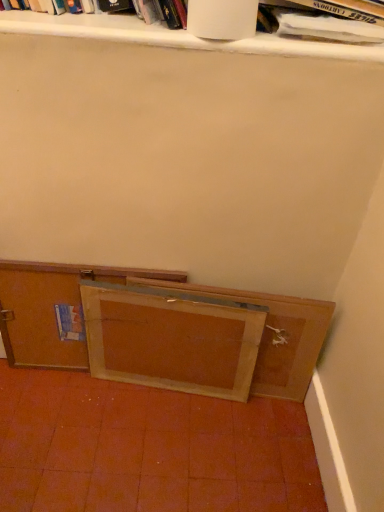
The width and height of the screenshot is (384, 512). What do you see at coordinates (171, 339) in the screenshot?
I see `wooden frame at lower center` at bounding box center [171, 339].

In order to face white paper at upper right, the first book in the right-to-left sequence, should I rotate leftwards or rightwards?

Turn right approximately 16.038 degrees to face it.

What do you see at coordinates (99, 28) in the screenshot? The image size is (384, 512). I see `white matte book at upper center, the second book viewed from the right` at bounding box center [99, 28].

This screenshot has height=512, width=384. Find the location of `wooden cabinet at lower left, the 2th cabinetry in the right-to-left sequence`. wooden cabinet at lower left, the 2th cabinetry in the right-to-left sequence is located at coordinates (53, 310).

Are white matte book at upper center, placed as the 1th book when sorted from left to right, and wooden cabinet at lower left, which ranks as the first cabinetry in left-to-right order, located far from each other?

white matte book at upper center, placed as the 1th book when sorted from left to right, is actually quite close to wooden cabinet at lower left, which ranks as the first cabinetry in left-to-right order.

Which object is closer to the camera, white matte book at upper center, placed as the 1th book when sorted from left to right, or wooden cabinet at lower left, which ranks as the first cabinetry in left-to-right order?

white matte book at upper center, placed as the 1th book when sorted from left to right, is in front.

Is white matte book at upper center, the second book viewed from the right, looking in the opposite direction of wooden cabinet at lower left, which ranks as the first cabinetry in left-to-right order?

No, white matte book at upper center, the second book viewed from the right, is not facing the opposite direction of wooden cabinet at lower left, which ranks as the first cabinetry in left-to-right order.

Which of these two, white matte book at upper center, the second book viewed from the right, or wooden cabinet at lower left, the 2th cabinetry in the right-to-left sequence, stands shorter?

With less height is white matte book at upper center, the second book viewed from the right.

Can you confirm if wooden cabinet at lower left, the 2th cabinetry in the right-to-left sequence, is smaller than white matte book at upper center, the second book viewed from the right?

Yes, wooden cabinet at lower left, the 2th cabinetry in the right-to-left sequence, is smaller than white matte book at upper center, the second book viewed from the right.

Is the position of wooden cabinet at lower left, the 2th cabinetry in the right-to-left sequence, less distant than that of white matte book at upper center, placed as the 1th book when sorted from left to right?

No, wooden cabinet at lower left, the 2th cabinetry in the right-to-left sequence, is further to the viewer.

How different are the orientations of wooden cabinet at lower left, the 2th cabinetry in the right-to-left sequence, and white matte book at upper center, the second book viewed from the right, in degrees?

wooden cabinet at lower left, the 2th cabinetry in the right-to-left sequence, and white matte book at upper center, the second book viewed from the right, are facing 0.236 degrees away from each other.

Which object is positioned more to the left, wooden frame at lower center, marked as the 2th cabinetry in a left-to-right arrangement, or wooden cabinet at lower left, which ranks as the first cabinetry in left-to-right order?

From the viewer's perspective, wooden cabinet at lower left, which ranks as the first cabinetry in left-to-right order, appears more on the left side.

From a real-world perspective, is wooden frame at lower center, the 1th cabinetry viewed from the right, on wooden cabinet at lower left, the 2th cabinetry in the right-to-left sequence?

Incorrect, from a real-world perspective, wooden frame at lower center, the 1th cabinetry viewed from the right, is lower than wooden cabinet at lower left, the 2th cabinetry in the right-to-left sequence.

Can you confirm if wooden frame at lower center, marked as the 2th cabinetry in a left-to-right arrangement, is thinner than wooden cabinet at lower left, which ranks as the first cabinetry in left-to-right order?

Incorrect, the width of wooden frame at lower center, marked as the 2th cabinetry in a left-to-right arrangement, is not less than that of wooden cabinet at lower left, which ranks as the first cabinetry in left-to-right order.

Looking at this image, how far apart are white paper at upper right, which ranks as the second book in left-to-right order, and wooden frame at lower center?

A distance of 65.06 centimeters exists between white paper at upper right, which ranks as the second book in left-to-right order, and wooden frame at lower center.

How many degrees apart are the facing directions of white paper at upper right, the first book in the right-to-left sequence, and wooden frame at lower center?

white paper at upper right, the first book in the right-to-left sequence, and wooden frame at lower center are facing 6.55 degrees away from each other.

At what (x,y) coordinates should I click in order to perform the action: click on wide beneath the white paper at upper right, the first book in the right-to-left sequence (from a real-world perspective). Please return your answer as a coordinate pair (x, y). This screenshot has height=512, width=384. Looking at the image, I should click on (171, 339).

Considering the points (317, 24) and (145, 358), which point is in front, point (317, 24) or point (145, 358)?

The point (317, 24) is more forward.

From a real-world perspective, is white matte book at upper center, placed as the 1th book when sorted from left to right, on white paper at upper right, the first book in the right-to-left sequence?

No.

Identify the location of book below the white paper at upper right, the first book in the right-to-left sequence (from a real-world perspective). (99, 28).

Is white matte book at upper center, placed as the 1th book when sorted from left to right, positioned with its back to white paper at upper right, the first book in the right-to-left sequence?

No, white matte book at upper center, placed as the 1th book when sorted from left to right, is not facing away from white paper at upper right, the first book in the right-to-left sequence.

Is white matte book at upper center, placed as the 1th book when sorted from left to right, wider or thinner than white paper at upper right, the first book in the right-to-left sequence?

white matte book at upper center, placed as the 1th book when sorted from left to right, is wider than white paper at upper right, the first book in the right-to-left sequence.

From the image's perspective, is wooden cabinet at lower left, the 2th cabinetry in the right-to-left sequence, under wooden frame at lower center, the 1th cabinetry viewed from the right?

No, from the image's perspective, wooden cabinet at lower left, the 2th cabinetry in the right-to-left sequence, is not below wooden frame at lower center, the 1th cabinetry viewed from the right.

Considering the points (19, 298) and (64, 339), which point is behind, point (19, 298) or point (64, 339)?

The point (64, 339) is farther.

Considering the relative sizes of wooden cabinet at lower left, which ranks as the first cabinetry in left-to-right order, and wooden frame at lower center, marked as the 2th cabinetry in a left-to-right arrangement, in the image provided, is wooden cabinet at lower left, which ranks as the first cabinetry in left-to-right order, smaller than wooden frame at lower center, marked as the 2th cabinetry in a left-to-right arrangement,?

No.

From a real-world perspective, which object stands above the other?

From a 3D spatial view, white paper at upper right, the first book in the right-to-left sequence, is above.

Is white paper at upper right, the first book in the right-to-left sequence, completely or partially inside wooden frame at lower center, the 1th cabinetry viewed from the right?

No, white paper at upper right, the first book in the right-to-left sequence, is not a part of wooden frame at lower center, the 1th cabinetry viewed from the right.

From the image's perspective, is wooden frame at lower center, marked as the 2th cabinetry in a left-to-right arrangement, located above or below white paper at upper right, the first book in the right-to-left sequence?

Based on their image positions, wooden frame at lower center, marked as the 2th cabinetry in a left-to-right arrangement, is located beneath white paper at upper right, the first book in the right-to-left sequence.

From a real-world perspective, count 1st cabinetrys downward from the white matte book at upper center, the second book viewed from the right, and point to it. Please provide its 2D coordinates.

[(53, 310)]

There is a wooden cabinet at lower left, which ranks as the first cabinetry in left-to-right order. Where is `the 1st book above it (from the image's perspective)`? The image size is (384, 512). the 1st book above it (from the image's perspective) is located at coordinates (99, 28).

Estimate the real-world distances between objects in this image. Which object is further from wooden frame at lower center, wooden cabinet at lower left, which ranks as the first cabinetry in left-to-right order, or white paper at upper right, which ranks as the second book in left-to-right order?

Based on the image, white paper at upper right, which ranks as the second book in left-to-right order, appears to be further to wooden frame at lower center.

Considering their positions, is wooden frame at lower center positioned further to white matte book at upper center, the second book viewed from the right, than wooden frame at lower center, marked as the 2th cabinetry in a left-to-right arrangement?

wooden frame at lower center is further to white matte book at upper center, the second book viewed from the right.

Considering their positions, is white matte book at upper center, the second book viewed from the right, positioned closer to white paper at upper right, which ranks as the second book in left-to-right order, than wooden frame at lower center, marked as the 2th cabinetry in a left-to-right arrangement?

white matte book at upper center, the second book viewed from the right.

Estimate the real-world distances between objects in this image. Which object is closer to white paper at upper right, which ranks as the second book in left-to-right order, wooden frame at lower center, the 1th cabinetry viewed from the right, or wooden cabinet at lower left, which ranks as the first cabinetry in left-to-right order?

wooden frame at lower center, the 1th cabinetry viewed from the right.

Estimate the real-world distances between objects in this image. Which object is further from wooden frame at lower center, wooden cabinet at lower left, the 2th cabinetry in the right-to-left sequence, or white matte book at upper center, placed as the 1th book when sorted from left to right?

Based on the image, white matte book at upper center, placed as the 1th book when sorted from left to right, appears to be further to wooden frame at lower center.

Estimate the real-world distances between objects in this image. Which object is further from wooden cabinet at lower left, which ranks as the first cabinetry in left-to-right order, wooden frame at lower center or white paper at upper right, the first book in the right-to-left sequence?

white paper at upper right, the first book in the right-to-left sequence.

Considering their positions, is wooden cabinet at lower left, which ranks as the first cabinetry in left-to-right order, positioned further to wooden frame at lower center, the 1th cabinetry viewed from the right, than wooden frame at lower center?

Based on the image, wooden cabinet at lower left, which ranks as the first cabinetry in left-to-right order, appears to be further to wooden frame at lower center, the 1th cabinetry viewed from the right.

Estimate the real-world distances between objects in this image. Which object is further from wooden frame at lower center, the 1th cabinetry viewed from the right, wooden cabinet at lower left, which ranks as the first cabinetry in left-to-right order, or white matte book at upper center, placed as the 1th book when sorted from left to right?

Based on the image, white matte book at upper center, placed as the 1th book when sorted from left to right, appears to be further to wooden frame at lower center, the 1th cabinetry viewed from the right.

At what (x,y) coordinates should I click in order to perform the action: click on book that lies between white paper at upper right, which ranks as the second book in left-to-right order, and wooden frame at lower center, marked as the 2th cabinetry in a left-to-right arrangement, from top to bottom. Please return your answer as a coordinate pair (x, y). This screenshot has height=512, width=384. Looking at the image, I should click on (99, 28).

The width and height of the screenshot is (384, 512). I want to click on book between white paper at upper right, the first book in the right-to-left sequence, and wooden frame at lower center, in the vertical direction, so click(99, 28).

Find the location of a particular element. The image size is (384, 512). cabinetry between white paper at upper right, which ranks as the second book in left-to-right order, and wooden frame at lower center, the 1th cabinetry viewed from the right, in the up-down direction is located at coordinates (53, 310).

Locate an element on the screen. This screenshot has width=384, height=512. book between white paper at upper right, which ranks as the second book in left-to-right order, and wooden cabinet at lower left, the 2th cabinetry in the right-to-left sequence, in the vertical direction is located at coordinates (99, 28).